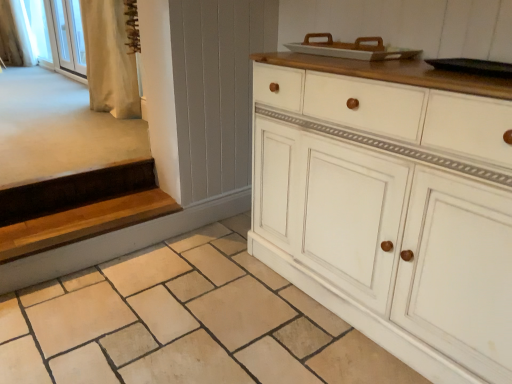
Find the location of a particular element. The height and width of the screenshot is (384, 512). white glass screen door at upper left is located at coordinates (69, 36).

The image size is (512, 384). Describe the element at coordinates (14, 35) in the screenshot. I see `white fabric curtain at upper left, which is counted as the second curtain, starting from the front` at that location.

Describe the element at coordinates (38, 29) in the screenshot. I see `white fabric at upper left` at that location.

In order to face white painted wood cabinet at center, should I rotate leftwards or rightwards?

Rotate right and turn 17.802 degrees.

The width and height of the screenshot is (512, 384). I want to click on beige fabric curtain at upper left, which is the 1th curtain from bottom to top, so click(x=109, y=60).

What do you see at coordinates (109, 60) in the screenshot?
I see `beige fabric curtain at upper left, which is the 1th curtain from bottom to top` at bounding box center [109, 60].

Where is `white glass screen door at upper left`? Image resolution: width=512 pixels, height=384 pixels. white glass screen door at upper left is located at coordinates (69, 36).

Considering the sizes of objects white fabric at upper left and natural stone tile at lower center in the image provided, who is smaller, white fabric at upper left or natural stone tile at lower center?

With smaller size is natural stone tile at lower center.

Is white fabric at upper left in front of or behind natural stone tile at lower center in the image?

Visually, white fabric at upper left is located behind natural stone tile at lower center.

From a real-world perspective, between white fabric at upper left and natural stone tile at lower center, who is vertically lower?

In real-world perspective, natural stone tile at lower center is lower.

From the image's perspective, is white fabric curtain at upper left, which ranks as the second curtain in right-to-left order, on white fabric at upper left?

Indeed, from the image's perspective, white fabric curtain at upper left, which ranks as the second curtain in right-to-left order, is shown above white fabric at upper left.

Considering the sizes of objects white fabric curtain at upper left, which ranks as the second curtain in right-to-left order, and white fabric at upper left in the image provided, who is smaller, white fabric curtain at upper left, which ranks as the second curtain in right-to-left order, or white fabric at upper left?

white fabric curtain at upper left, which ranks as the second curtain in right-to-left order.

Would you say white fabric at upper left is part of white fabric curtain at upper left, the 1th curtain in the back-to-front sequence,'s contents?

No, white fabric curtain at upper left, the 1th curtain in the back-to-front sequence, does not contain white fabric at upper left.

Considering the relative sizes of wooden at left and beige fabric curtain at upper left, which is the 1th curtain from bottom to top, in the image provided, is wooden at left shorter than beige fabric curtain at upper left, which is the 1th curtain from bottom to top,?

Correct, wooden at left is not as tall as beige fabric curtain at upper left, which is the 1th curtain from bottom to top.

Can you confirm if wooden at left is smaller than beige fabric curtain at upper left, the 1th curtain positioned from the front?

Correct, wooden at left occupies less space than beige fabric curtain at upper left, the 1th curtain positioned from the front.

Can you confirm if wooden at left is thinner than beige fabric curtain at upper left, acting as the first curtain starting from the right?

Incorrect, the width of wooden at left is not less than that of beige fabric curtain at upper left, acting as the first curtain starting from the right.

Is wooden at left next to beige fabric curtain at upper left, which is the 1th curtain from bottom to top?

No, wooden at left is not making contact with beige fabric curtain at upper left, which is the 1th curtain from bottom to top.

From a real-world perspective, is white fabric curtain at upper left, which ranks as the second curtain in right-to-left order, on top of wooden at left?

Correct, in the physical world, white fabric curtain at upper left, which ranks as the second curtain in right-to-left order, is higher than wooden at left.

There is a wooden at left. At what (x,y) coordinates should I click in order to perform the action: click on the 2nd curtain above it (from the image's perspective). Please return your answer as a coordinate pair (x, y). The width and height of the screenshot is (512, 384). Looking at the image, I should click on (14, 35).

How different are the orientations of white fabric curtain at upper left, which ranks as the second curtain in right-to-left order, and wooden at left in degrees?

The angular difference between white fabric curtain at upper left, which ranks as the second curtain in right-to-left order, and wooden at left is 91.4 degrees.

Is natural stone tile at lower center in front of white glass screen door at upper left?

Yes, the depth of natural stone tile at lower center is less than that of white glass screen door at upper left.

Is natural stone tile at lower center facing away from white glass screen door at upper left?

No, natural stone tile at lower center is not facing the opposite direction of white glass screen door at upper left.

Does point (210, 366) appear closer or farther from the camera than point (55, 18)?

Point (210, 366) is closer to the camera than point (55, 18).

Does natural stone tile at lower center have a lesser width compared to white glass screen door at upper left?

In fact, natural stone tile at lower center might be wider than white glass screen door at upper left.

Which point is more distant from viewer, [37,20] or [30,50]?

Point [30,50]

From the image's perspective, does white fabric at upper left appear lower than white fabric curtain at upper left, positioned as the 1th curtain in left-to-right order?

Indeed, from the image's perspective, white fabric at upper left is shown beneath white fabric curtain at upper left, positioned as the 1th curtain in left-to-right order.

Based on the photo, can you confirm if white fabric at upper left is shorter than white fabric curtain at upper left, which is counted as the 2th curtain, starting from the bottom?

Yes, white fabric at upper left is shorter than white fabric curtain at upper left, which is counted as the 2th curtain, starting from the bottom.

Is white fabric at upper left looking in the opposite direction of white fabric curtain at upper left, which is counted as the 2th curtain, starting from the bottom?

Yes, white fabric at upper left's orientation is away from white fabric curtain at upper left, which is counted as the 2th curtain, starting from the bottom.

Looking at this image, measure the distance from white painted wood cabinet at center to white glass screen door at upper left.

4.15 meters.

Based on the photo, which object is thinner, white painted wood cabinet at center or white glass screen door at upper left?

With smaller width is white glass screen door at upper left.

From the image's perspective, which one is positioned lower, white painted wood cabinet at center or white glass screen door at upper left?

white painted wood cabinet at center, from the image's perspective.

Which point is more distant from viewer, (412, 93) or (75, 43)?

The point (75, 43) is farther from the camera.

The image size is (512, 384). In order to click on tile below the white fabric at upper left (from the image's perspective) in this screenshot , I will do `click(184, 323)`.

This screenshot has height=384, width=512. What are the coordinates of `window screen on the right of white fabric curtain at upper left, which is counted as the 1th curtain, starting from the top` in the screenshot? It's located at (38, 29).

Estimate the real-world distances between objects in this image. Which object is closer to natural stone tile at lower center, white painted wood cabinet at center or white glass screen door at upper left?

white painted wood cabinet at center is positioned closer to the anchor natural stone tile at lower center.

Based on their spatial positions, is white glass screen door at upper left or wooden at left further from beige fabric curtain at upper left, which is the 1th curtain from bottom to top?

Based on the image, white glass screen door at upper left appears to be further to beige fabric curtain at upper left, which is the 1th curtain from bottom to top.

Consider the image. From the image, which object appears to be farther from wooden at left, white painted wood cabinet at center or natural stone tile at lower center?

Among the two, white painted wood cabinet at center is located further to wooden at left.

Which object lies further to the anchor point wooden at left, white glass screen door at upper left or white fabric at upper left?

white fabric at upper left is further to wooden at left.

Estimate the real-world distances between objects in this image. Which object is closer to beige fabric curtain at upper left, which appears as the second curtain when viewed from the back, white glass screen door at upper left or white fabric curtain at upper left, which is counted as the 2th curtain, starting from the bottom?

white glass screen door at upper left lies closer to beige fabric curtain at upper left, which appears as the second curtain when viewed from the back, than the other object.

From the image, which object appears to be farther from beige fabric curtain at upper left, which is the 1th curtain from bottom to top, wooden at left or white painted wood cabinet at center?

white painted wood cabinet at center is further to beige fabric curtain at upper left, which is the 1th curtain from bottom to top.

Based on their spatial positions, is natural stone tile at lower center or white glass screen door at upper left further from wooden at left?

white glass screen door at upper left lies further to wooden at left than the other object.

Estimate the real-world distances between objects in this image. Which object is further from white glass screen door at upper left, beige fabric curtain at upper left, arranged as the 2th curtain when viewed from the top, or white fabric curtain at upper left, the 1th curtain in the back-to-front sequence?

The object further to white glass screen door at upper left is beige fabric curtain at upper left, arranged as the 2th curtain when viewed from the top.

At what (x,y) coordinates should I click in order to perform the action: click on tile situated between wooden at left and white painted wood cabinet at center from left to right. Please return your answer as a coordinate pair (x, y). The image size is (512, 384). Looking at the image, I should click on (184, 323).

Locate an element on the screen. This screenshot has width=512, height=384. curtain located between white painted wood cabinet at center and white fabric curtain at upper left, the 1th curtain in the back-to-front sequence, in the depth direction is located at coordinates click(109, 60).

This screenshot has width=512, height=384. I want to click on stairs between white painted wood cabinet at center and white glass screen door at upper left from front to back, so click(x=78, y=207).

This screenshot has width=512, height=384. In order to click on the chest of drawers located between natural stone tile at lower center and white fabric curtain at upper left, which is counted as the 1th curtain, starting from the top, in the depth direction in this screenshot , I will do `click(391, 204)`.